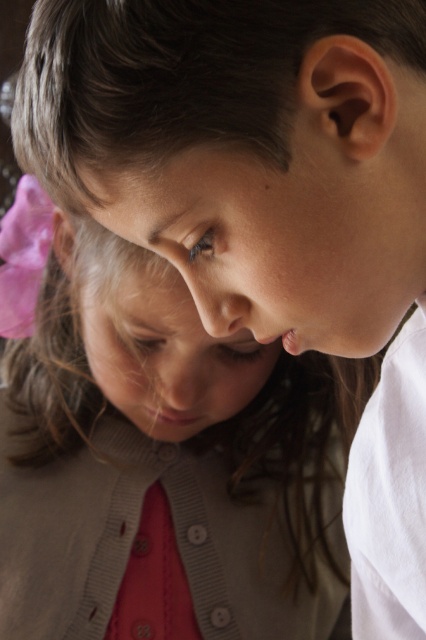
Who is taller, pink fabric hairband at upper left or matte pink bow at upper left?

With more height is pink fabric hairband at upper left.

Where is `pink fabric hairband at upper left`? pink fabric hairband at upper left is located at coordinates (155, 452).

Measure the distance between pink fabric hairband at upper left and camera.

pink fabric hairband at upper left is 29.19 inches from camera.

At what (x,y) coordinates should I click in order to perform the action: click on pink fabric hairband at upper left. Please return your answer as a coordinate pair (x, y). Image resolution: width=426 pixels, height=640 pixels. Looking at the image, I should click on coord(155,452).